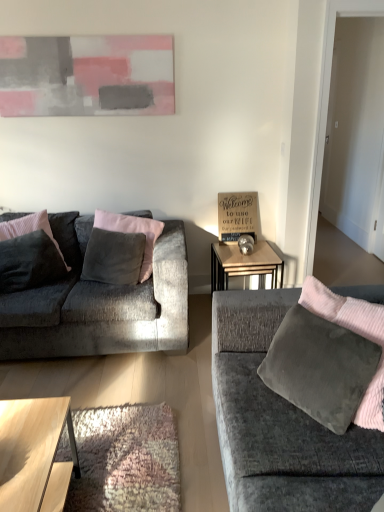
Where is `vacant space in front of velvet grey couch at left, the 1th studio couch positioned from the left`? Image resolution: width=384 pixels, height=512 pixels. vacant space in front of velvet grey couch at left, the 1th studio couch positioned from the left is located at coordinates (112, 410).